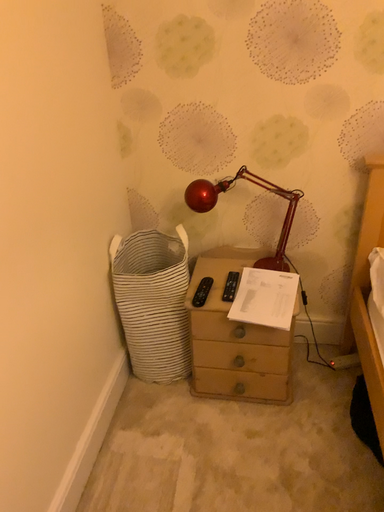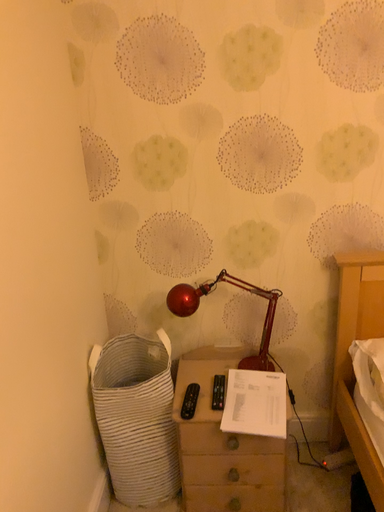
Question: Which way did the camera rotate in the video?

Choices:
 (A) rotated upward
 (B) rotated downward

Answer: (A)